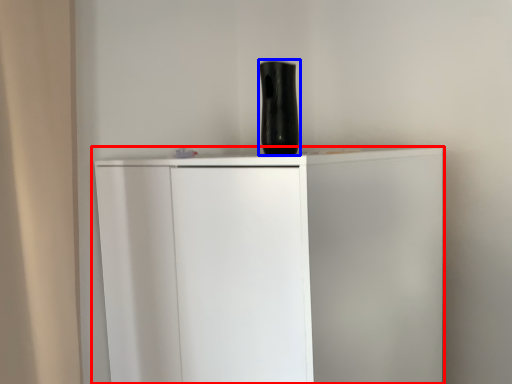
Question: Among these objects, which one is nearest to the camera, cupboard (highlighted by a red box) or vase (highlighted by a blue box)?

Choices:
 (A) cupboard
 (B) vase

Answer: (A)